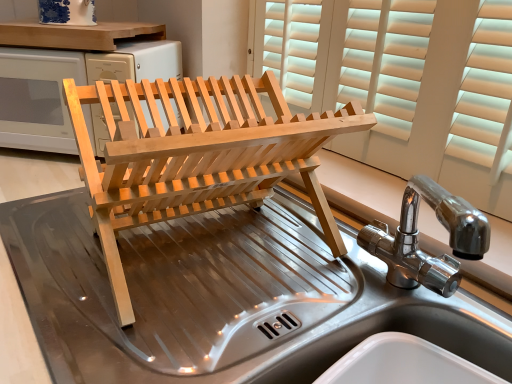
What is the approximate width of stainless steel sink at center, which ranks as the first sink in bottom-to-top order?

It is 23.99 inches.

The height and width of the screenshot is (384, 512). Identify the location of polished stainless steel sink at center, placed as the 1th sink when sorted from top to bottom. (418, 240).

The height and width of the screenshot is (384, 512). What do you see at coordinates (418, 240) in the screenshot?
I see `polished stainless steel sink at center, the second sink from the bottom` at bounding box center [418, 240].

In order to click on stainless steel sink at center, the second sink from the top in this screenshot , I will do `click(218, 297)`.

Is stainless steel sink at center, the second sink from the top, looking in the opposite direction of natural wood dish rack at center?

stainless steel sink at center, the second sink from the top, does not have its back to natural wood dish rack at center.

Between stainless steel sink at center, the second sink from the top, and natural wood dish rack at center, which one has larger size?

stainless steel sink at center, the second sink from the top.

Where is `sink that is on the left side of natural wood dish rack at center`? This screenshot has height=384, width=512. sink that is on the left side of natural wood dish rack at center is located at coordinates (218, 297).

Are stainless steel sink at center, the second sink from the top, and natural wood dish rack at center beside each other?

stainless steel sink at center, the second sink from the top, and natural wood dish rack at center are clearly separated.

Where is `sink lying on the left of polished stainless steel sink at center, placed as the 1th sink when sorted from top to bottom`? The height and width of the screenshot is (384, 512). sink lying on the left of polished stainless steel sink at center, placed as the 1th sink when sorted from top to bottom is located at coordinates (218, 297).

Considering the relative positions of polished stainless steel sink at center, the second sink from the bottom, and stainless steel sink at center, which ranks as the first sink in bottom-to-top order, in the image provided, is polished stainless steel sink at center, the second sink from the bottom, to the right of stainless steel sink at center, which ranks as the first sink in bottom-to-top order, from the viewer's perspective?

Indeed, polished stainless steel sink at center, the second sink from the bottom, is positioned on the right side of stainless steel sink at center, which ranks as the first sink in bottom-to-top order.

Is polished stainless steel sink at center, the second sink from the bottom, not near stainless steel sink at center, the second sink from the top?

No, polished stainless steel sink at center, the second sink from the bottom, is in close proximity to stainless steel sink at center, the second sink from the top.

From the picture: Is the position of polished stainless steel sink at center, placed as the 1th sink when sorted from top to bottom, more distant than that of stainless steel sink at center, the second sink from the top?

Yes, it is behind stainless steel sink at center, the second sink from the top.

Based on their positions, is natural wood dish rack at center located to the left or right of stainless steel sink at center, the second sink from the top?

natural wood dish rack at center is positioned on stainless steel sink at center, the second sink from the top,'s right side.

From the image's perspective, which one is positioned higher, natural wood dish rack at center or stainless steel sink at center, the second sink from the top?

From the image's view, natural wood dish rack at center is above.

Looking at this image, is natural wood dish rack at center facing away from stainless steel sink at center, the second sink from the top?

No.

You are a GUI agent. You are given a task and a screenshot of the screen. Output one action in this format:
    pyautogui.click(x=<x>, y=<y>)
    Task: Click on the sink that is above the natural wood dish rack at center (from a real-world perspective)
    
    Given the screenshot: What is the action you would take?
    pyautogui.click(x=418, y=240)

Is natural wood dish rack at center turned away from polished stainless steel sink at center, the second sink from the bottom?

No, natural wood dish rack at center's orientation is not away from polished stainless steel sink at center, the second sink from the bottom.

Considering the relative sizes of natural wood dish rack at center and polished stainless steel sink at center, placed as the 1th sink when sorted from top to bottom, in the image provided, is natural wood dish rack at center bigger than polished stainless steel sink at center, placed as the 1th sink when sorted from top to bottom,?

Correct, natural wood dish rack at center is larger in size than polished stainless steel sink at center, placed as the 1th sink when sorted from top to bottom.

Who is more distant, natural wood dish rack at center or polished stainless steel sink at center, the second sink from the bottom?

natural wood dish rack at center.

Is stainless steel sink at center, the second sink from the top, oriented towards polished stainless steel sink at center, placed as the 1th sink when sorted from top to bottom?

No, stainless steel sink at center, the second sink from the top, is not oriented towards polished stainless steel sink at center, placed as the 1th sink when sorted from top to bottom.

From a real-world perspective, is stainless steel sink at center, the second sink from the top, above or below polished stainless steel sink at center, placed as the 1th sink when sorted from top to bottom?

In terms of real-world spatial position, stainless steel sink at center, the second sink from the top, is below polished stainless steel sink at center, placed as the 1th sink when sorted from top to bottom.

Could you measure the distance between stainless steel sink at center, which ranks as the first sink in bottom-to-top order, and polished stainless steel sink at center, the second sink from the bottom?

The distance of stainless steel sink at center, which ranks as the first sink in bottom-to-top order, from polished stainless steel sink at center, the second sink from the bottom, is 10.30 inches.

Does stainless steel sink at center, which ranks as the first sink in bottom-to-top order, touch polished stainless steel sink at center, placed as the 1th sink when sorted from top to bottom?

No, stainless steel sink at center, which ranks as the first sink in bottom-to-top order, is not next to polished stainless steel sink at center, placed as the 1th sink when sorted from top to bottom.

Does point (460, 227) appear closer or farther from the camera than point (307, 164)?

Point (460, 227) is positioned closer to the camera compared to point (307, 164).

From the image's perspective, which one is positioned lower, polished stainless steel sink at center, the second sink from the bottom, or natural wood dish rack at center?

polished stainless steel sink at center, the second sink from the bottom, appears lower in the image.

Does polished stainless steel sink at center, placed as the 1th sink when sorted from top to bottom, have a greater height compared to natural wood dish rack at center?

No, polished stainless steel sink at center, placed as the 1th sink when sorted from top to bottom, is not taller than natural wood dish rack at center.

From the picture: Between polished stainless steel sink at center, the second sink from the bottom, and natural wood dish rack at center, which one has smaller size?

polished stainless steel sink at center, the second sink from the bottom, is smaller.

From the natural wood dish rack at center, count 2nd sinks forward and point to it. Please provide its 2D coordinates.

[(218, 297)]

This screenshot has height=384, width=512. What are the coordinates of `sink located behind the stainless steel sink at center, the second sink from the top` in the screenshot? It's located at (418, 240).

Looking at the image, which one is located further to natural wood dish rack at center, stainless steel sink at center, which ranks as the first sink in bottom-to-top order, or polished stainless steel sink at center, placed as the 1th sink when sorted from top to bottom?

Based on the image, polished stainless steel sink at center, placed as the 1th sink when sorted from top to bottom, appears to be further to natural wood dish rack at center.

Considering their positions, is polished stainless steel sink at center, placed as the 1th sink when sorted from top to bottom, positioned further to natural wood dish rack at center than stainless steel sink at center, the second sink from the top?

The object further to natural wood dish rack at center is polished stainless steel sink at center, placed as the 1th sink when sorted from top to bottom.

Which object lies further to the anchor point polished stainless steel sink at center, placed as the 1th sink when sorted from top to bottom, stainless steel sink at center, which ranks as the first sink in bottom-to-top order, or natural wood dish rack at center?

The object further to polished stainless steel sink at center, placed as the 1th sink when sorted from top to bottom, is stainless steel sink at center, which ranks as the first sink in bottom-to-top order.

Based on their spatial positions, is natural wood dish rack at center or polished stainless steel sink at center, the second sink from the bottom, closer to stainless steel sink at center, the second sink from the top?

natural wood dish rack at center is closer to stainless steel sink at center, the second sink from the top.

Estimate the real-world distances between objects in this image. Which object is closer to polished stainless steel sink at center, the second sink from the bottom, natural wood dish rack at center or stainless steel sink at center, the second sink from the top?

natural wood dish rack at center is closer to polished stainless steel sink at center, the second sink from the bottom.

From the picture: Considering their positions, is polished stainless steel sink at center, placed as the 1th sink when sorted from top to bottom, positioned closer to stainless steel sink at center, which ranks as the first sink in bottom-to-top order, than natural wood dish rack at center?

Based on the image, natural wood dish rack at center appears to be nearer to stainless steel sink at center, which ranks as the first sink in bottom-to-top order.

At what (x,y) coordinates should I click in order to perform the action: click on sink between natural wood dish rack at center and stainless steel sink at center, the second sink from the top, from top to bottom. Please return your answer as a coordinate pair (x, y). The height and width of the screenshot is (384, 512). Looking at the image, I should click on (418, 240).